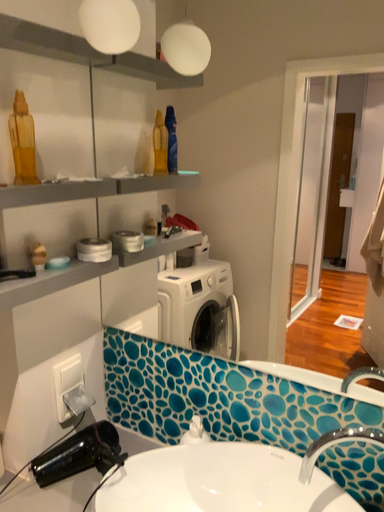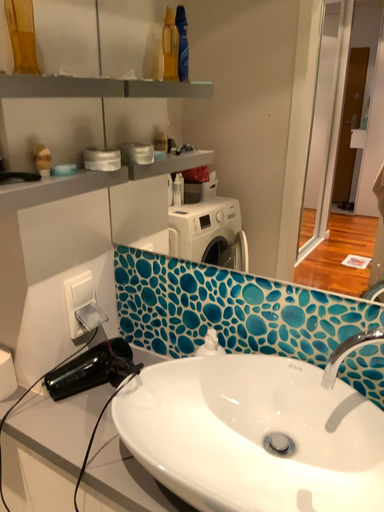
Question: How did the camera likely rotate when shooting the video?

Choices:
 (A) rotated downward
 (B) rotated upward

Answer: (A)